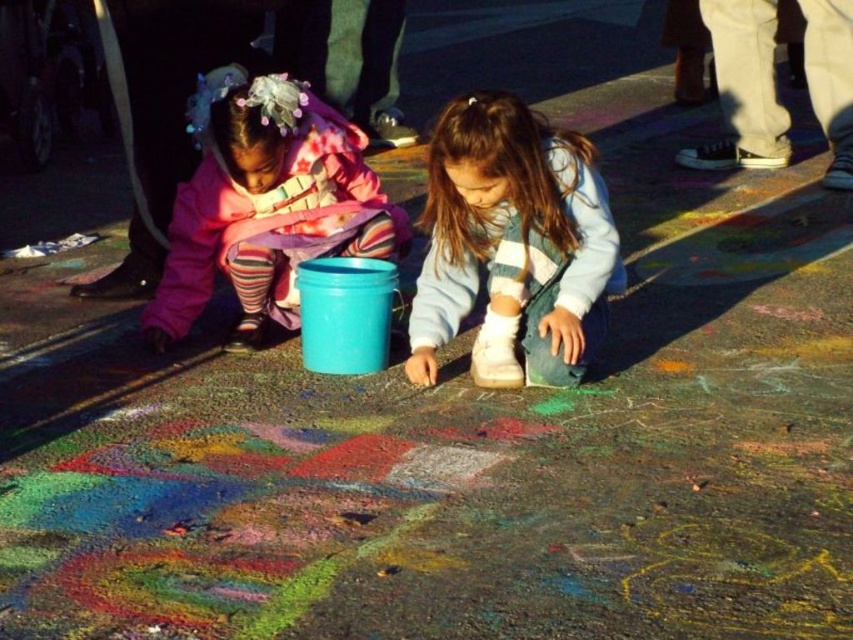
Is white suede sneakers at center thinner than matte pink jacket at left?

Yes, white suede sneakers at center is thinner than matte pink jacket at left.

Can you confirm if white suede sneakers at center is smaller than matte pink jacket at left?

Yes.

Is point (538, 308) positioned behind point (196, 305)?

No.

Identify the location of white suede sneakers at center. The height and width of the screenshot is (640, 853). (514, 244).